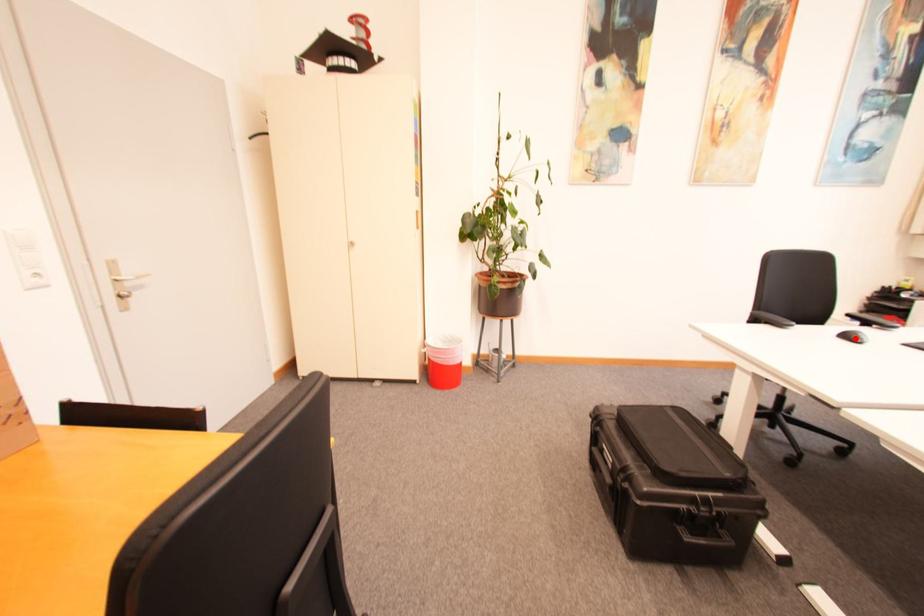
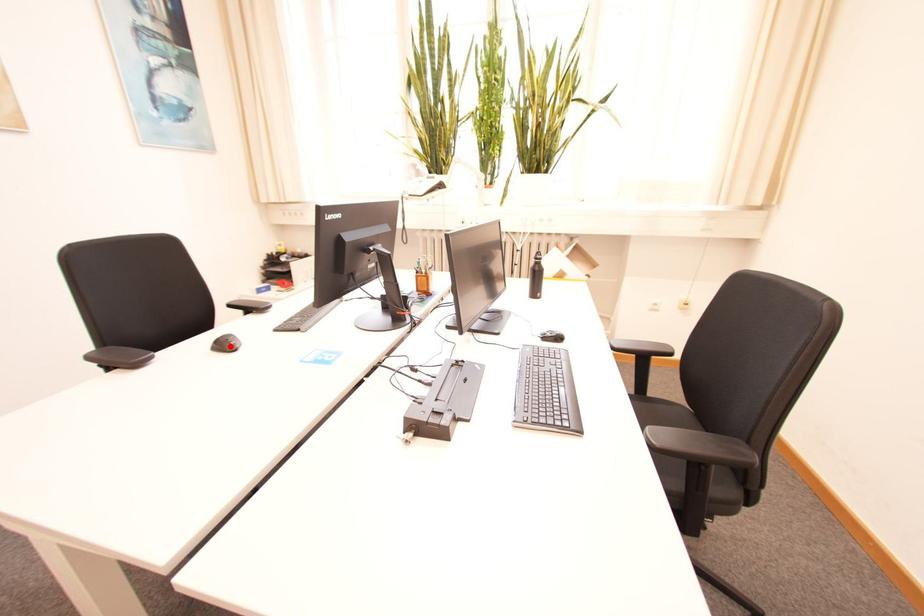
I am providing you with two images of the same scene from different viewpoints. A red point is marked on the first image and another point is marked on the second image. Do the highlighted points in image1 and image2 indicate the same real-world spot?

Yes